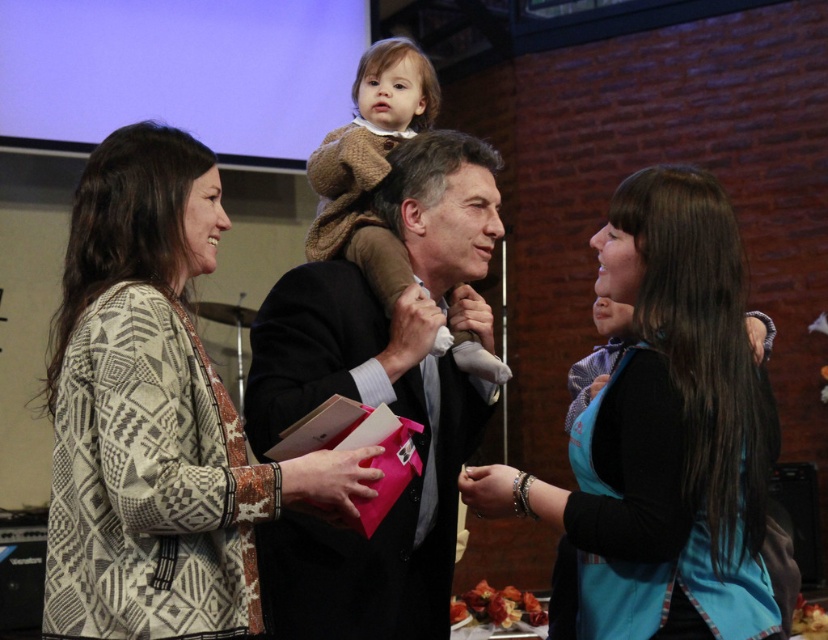
Between dark suit at center and black fabric apron at right, which one appears on the right side from the viewer's perspective?

From the viewer's perspective, black fabric apron at right appears more on the right side.

Which of these two, dark suit at center or black fabric apron at right, stands taller?

dark suit at center

You are a GUI agent. You are given a task and a screenshot of the screen. Output one action in this format:
    pyautogui.click(x=<x>, y=<y>)
    Task: Click on the dark suit at center
    This screenshot has height=640, width=828.
    Given the screenshot: What is the action you would take?
    pyautogui.click(x=379, y=400)

Find the location of a particular element. The image size is (828, 640). dark suit at center is located at coordinates (379, 400).

Is black fabric apron at right taller than brown knitted sweater at center?

Indeed, black fabric apron at right has a greater height compared to brown knitted sweater at center.

Image resolution: width=828 pixels, height=640 pixels. What do you see at coordinates (658, 400) in the screenshot? I see `black fabric apron at right` at bounding box center [658, 400].

At what (x,y) coordinates should I click in order to perform the action: click on black fabric apron at right. Please return your answer as a coordinate pair (x, y). This screenshot has height=640, width=828. Looking at the image, I should click on (658, 400).

Can you confirm if patterned knit sweater at left is taller than dark suit at center?

No.

Does point (148, 179) come in front of point (410, 557)?

Yes, it is.

Locate an element on the screen. Image resolution: width=828 pixels, height=640 pixels. patterned knit sweater at left is located at coordinates (153, 413).